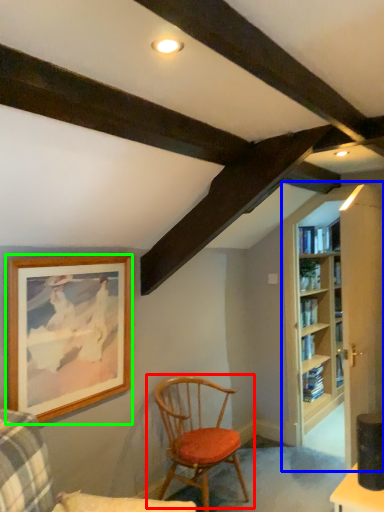
Question: Based on their relative distances, which object is farther from chair (highlighted by a red box)? Choose from bookcase (highlighted by a blue box) and picture frame (highlighted by a green box).

Choices:
 (A) bookcase
 (B) picture frame

Answer: (A)